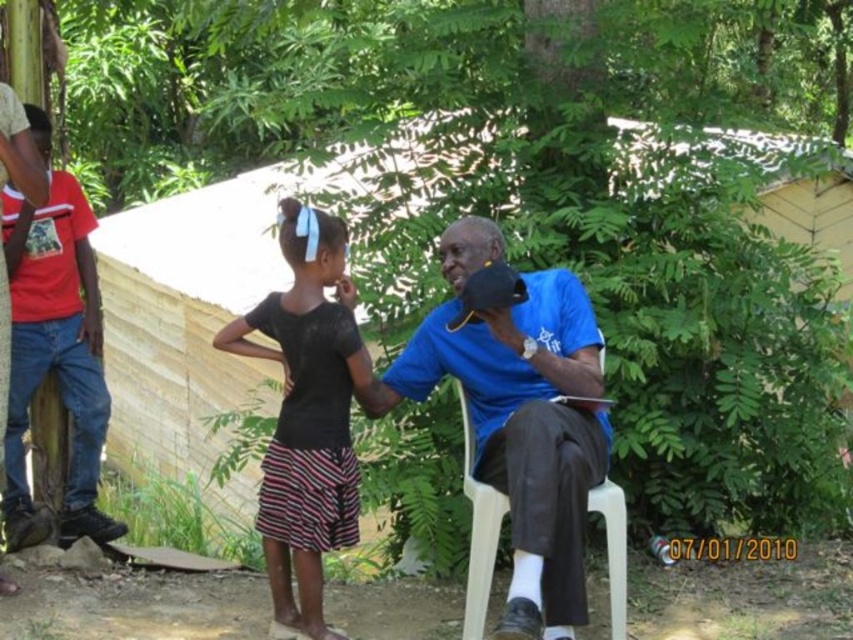
Question: Can you confirm if blue fabric shirt at center is thinner than black mesh shirt at center?

Choices:
 (A) no
 (B) yes

Answer: (A)

Question: Is blue fabric shirt at center further to the viewer compared to black mesh shirt at center?

Choices:
 (A) no
 (B) yes

Answer: (A)

Question: Which point appears closest to the camera in this image?

Choices:
 (A) (465, 404)
 (B) (126, 348)
 (C) (537, 330)

Answer: (C)

Question: Which point is farther from the camera taking this photo?

Choices:
 (A) (517, 308)
 (B) (242, 272)

Answer: (B)

Question: Which of the following is the closest to the observer?

Choices:
 (A) pyautogui.click(x=328, y=483)
 (B) pyautogui.click(x=480, y=566)
 (C) pyautogui.click(x=114, y=256)
 (D) pyautogui.click(x=387, y=408)

Answer: (B)

Question: Can you confirm if wooden fence at center is wider than blue fabric shirt at center?

Choices:
 (A) no
 (B) yes

Answer: (B)